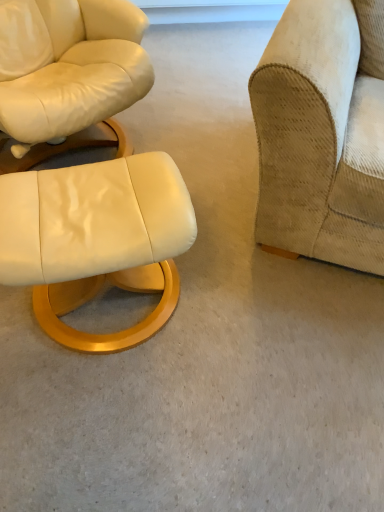
Find the location of a particular element. free spot in front of beige corduroy couch at right is located at coordinates (274, 355).